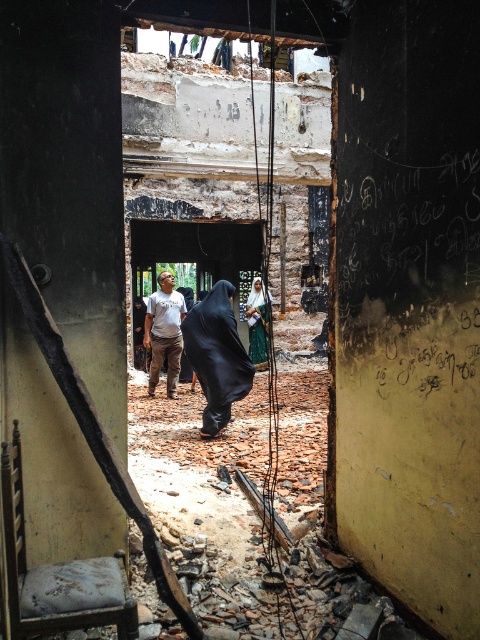
Which is below, black matte/velvet robe at center or light brown cotton shirt at center?

black matte/velvet robe at center

Does black matte/velvet robe at center appear over light brown cotton shirt at center?

Incorrect, black matte/velvet robe at center is not positioned above light brown cotton shirt at center.

Identify the location of black matte/velvet robe at center. (216, 355).

Is light brown cotton shirt at center wider than green fabric dress at center?

Indeed, light brown cotton shirt at center has a greater width compared to green fabric dress at center.

Which of these two, light brown cotton shirt at center or green fabric dress at center, stands taller?

light brown cotton shirt at center is taller.

I want to click on light brown cotton shirt at center, so click(x=165, y=332).

Does point (224, 336) come behind point (265, 333)?

No, it is not.

Can you confirm if black matte/velvet robe at center is shorter than green fabric dress at center?

Yes, black matte/velvet robe at center is shorter than green fabric dress at center.

Is point (230, 336) farther from viewer compared to point (249, 339)?

No, it is not.

At what (x,y) coordinates should I click in order to perform the action: click on black matte/velvet robe at center. Please return your answer as a coordinate pair (x, y). The height and width of the screenshot is (640, 480). Looking at the image, I should click on (216, 355).